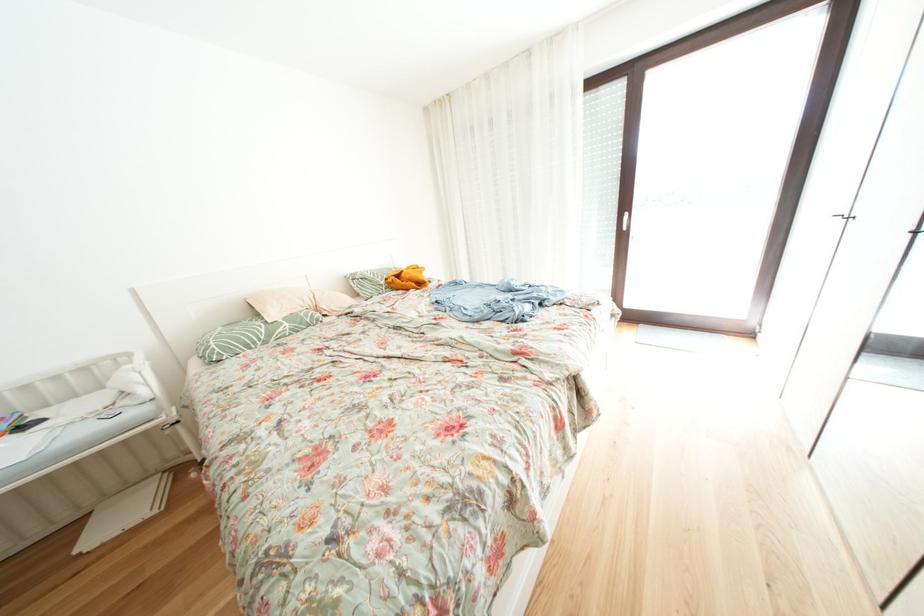
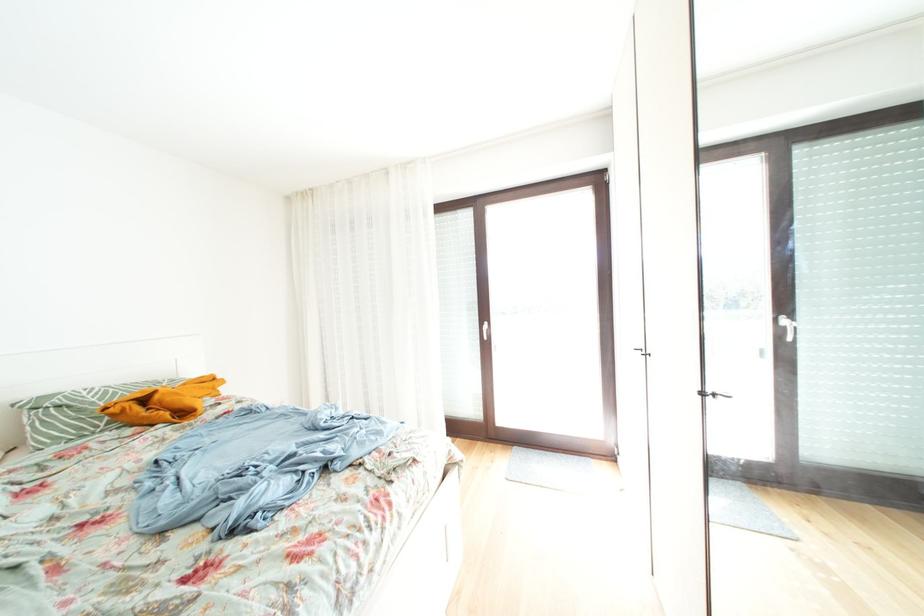
Which direction would the cameraman need to move to produce the second image?

The movement direction of the cameraman is right, forward.